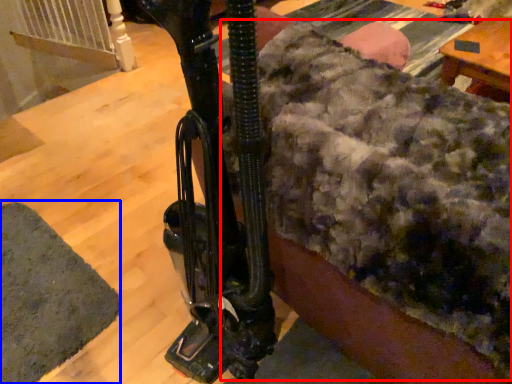
Question: Among these objects, which one is nearest to the camera, blanket (highlighted by a red box) or mat (highlighted by a blue box)?

Choices:
 (A) blanket
 (B) mat

Answer: (A)